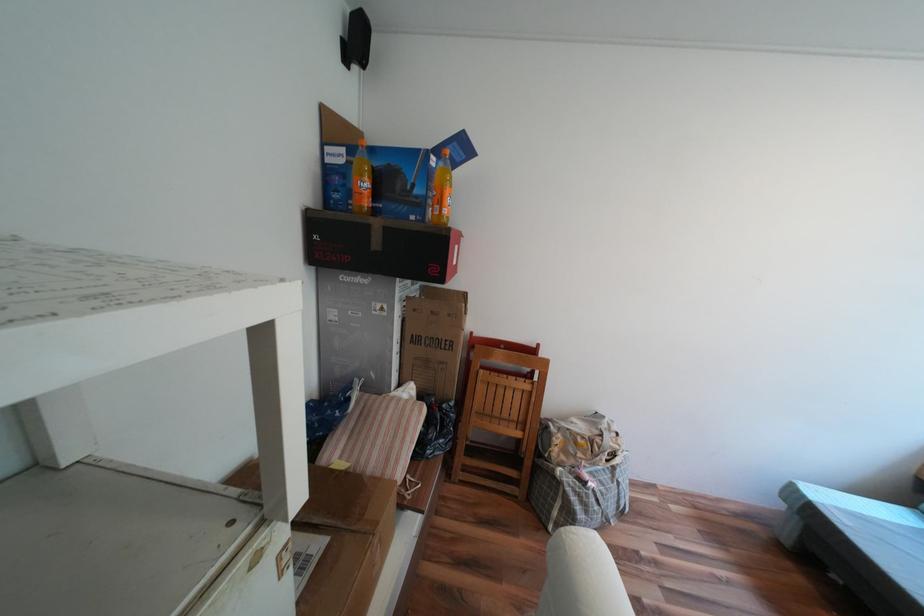
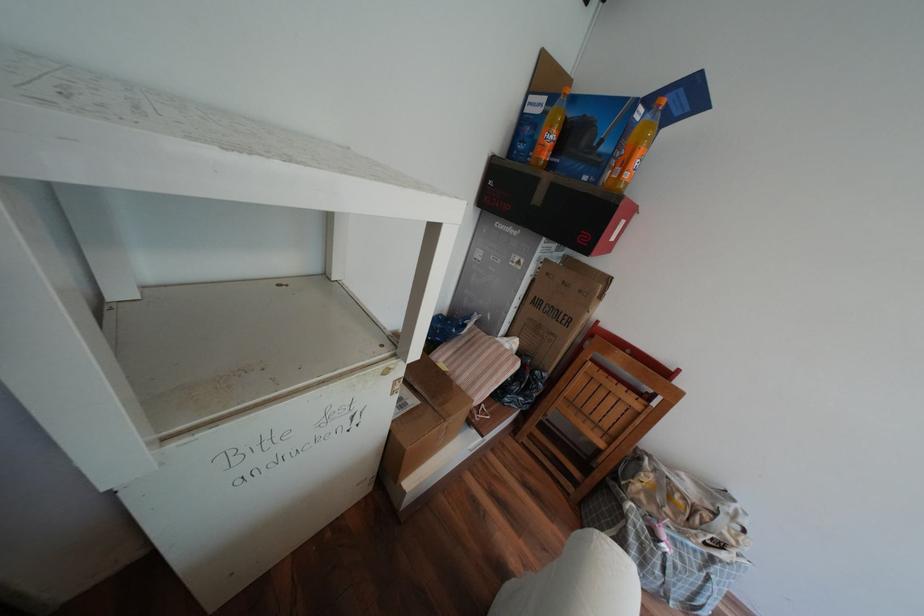
Find the pixel in the second image that matches point 446,151 in the first image.

(659, 100)